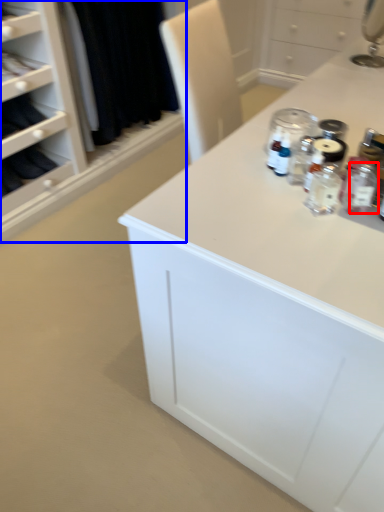
Question: Which point is closer to the camera, bottle (highlighted by a red box) or closet (highlighted by a blue box)?

Choices:
 (A) bottle
 (B) closet

Answer: (A)